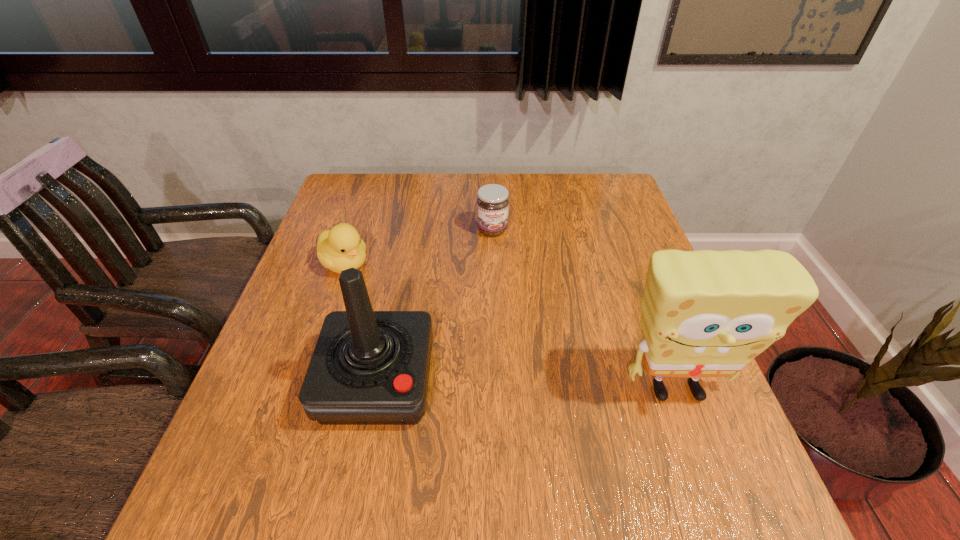
Identify the location of free space on the desktop that is between the joystick and the sponge and is positioned on the front label of the farthest object. (551, 386).

Where is `free space on the desktop that is between the joystick and the rightmost object and is positioned on the front-facing side of the duck`? This screenshot has height=540, width=960. free space on the desktop that is between the joystick and the rightmost object and is positioned on the front-facing side of the duck is located at coordinates (523, 386).